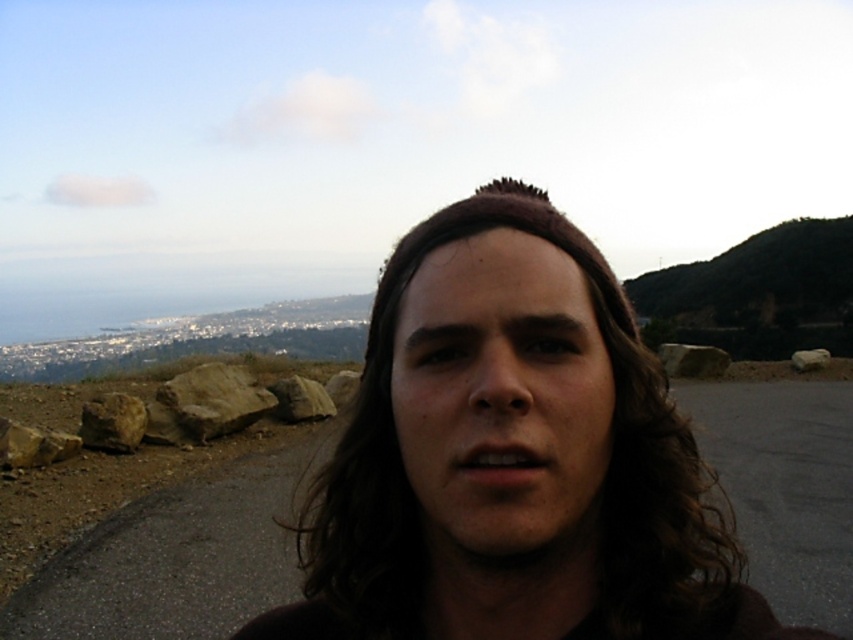
You are a photographer trying to capture the scenic landscape in the background. You notice the dirt road at center and the gray rock at center are blocking your view. Which object should you move closer to the camera to ensure the background remains visible?

The dirt road at center is closer to the viewer than the gray rock at center, so moving the dirt road at center closer would not help. Instead, you should move the gray rock at center closer to the camera to ensure the background remains visible.

You are a photographer trying to capture a landscape shot. You have a camera with a 50mm lens and want to focus on the dirt road at center while also including the gray rock at right in the frame. Given the spatial relationship between the two objects, will you need to adjust your camera settings to focus on both objects simultaneously?

The dirt road at center is closer to the viewer than the gray rock at right. Since they are at different distances from the camera, you will need to adjust your camera settings to ensure both are in focus, possibly using a smaller aperture for a greater depth of field.

You are a delivery person carrying a package and need to cross the dirt road at center. The package is 4 meters long. Can you safely carry it across without dropping it?

The dirt road at center is 4.27 meters wide, so the package is 4 meters long, which is shorter than the road width. Therefore, you can safely carry it across without dropping it.